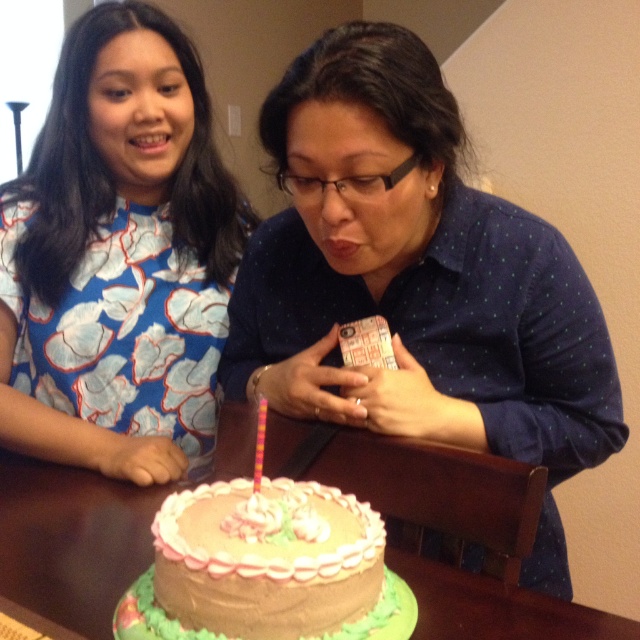
Is matte blue shirt at center to the left of chocolate frosted cake at center from the viewer's perspective?

Incorrect, matte blue shirt at center is not on the left side of chocolate frosted cake at center.

Is matte blue shirt at center closer to camera compared to chocolate frosted cake at center?

No, it is behind chocolate frosted cake at center.

At what (x,y) coordinates should I click in order to perform the action: click on matte blue shirt at center. Please return your answer as a coordinate pair (x, y). This screenshot has height=640, width=640. Looking at the image, I should click on (417, 280).

Does blue floral dress at left appear under smooth wooden table at center?

No, blue floral dress at left is not below smooth wooden table at center.

Does point (67, 58) come behind point (333, 444)?

Yes, point (67, 58) is behind point (333, 444).

The width and height of the screenshot is (640, 640). Identify the location of blue floral dress at left. (118, 257).

Who is positioned more to the left, smooth wooden table at center or chocolate frosted cake at center?

Positioned to the left is smooth wooden table at center.

Which is more to the right, smooth wooden table at center or chocolate frosted cake at center?

chocolate frosted cake at center is more to the right.

What do you see at coordinates (461, 536) in the screenshot? This screenshot has width=640, height=640. I see `smooth wooden table at center` at bounding box center [461, 536].

You are a GUI agent. You are given a task and a screenshot of the screen. Output one action in this format:
    pyautogui.click(x=<x>, y=<y>)
    Task: Click on the smooth wooden table at center
    Image resolution: width=640 pixels, height=640 pixels.
    Given the screenshot: What is the action you would take?
    pyautogui.click(x=461, y=536)